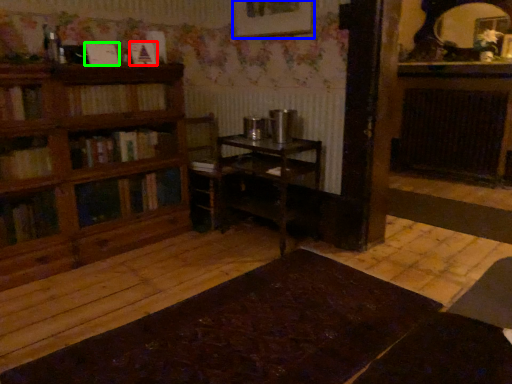
Question: Considering the real-world distances, which object is farthest from book (highlighted by a red box)? picture frame (highlighted by a blue box) or book (highlighted by a green box)?

Choices:
 (A) picture frame
 (B) book

Answer: (A)